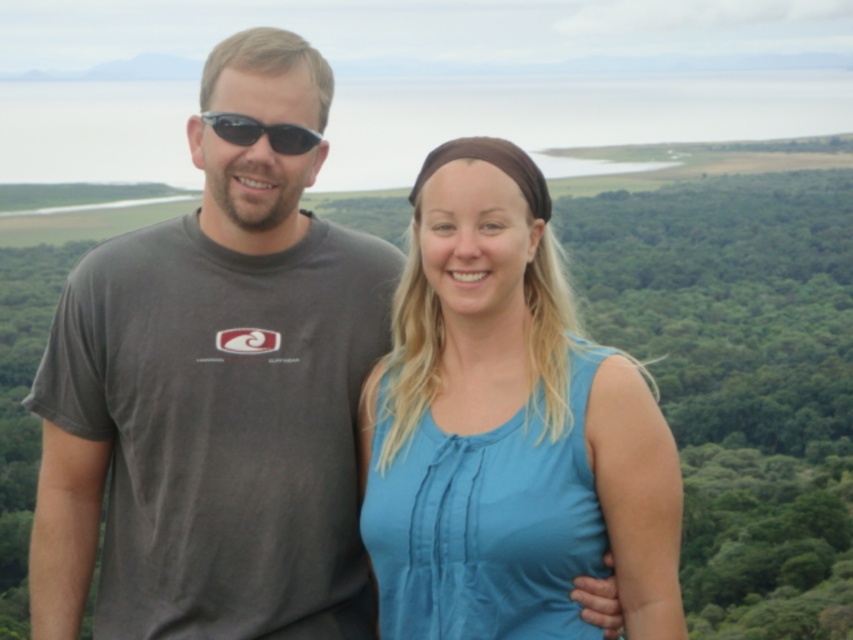
You are a photographer who needs to adjust the lighting for a closeup shot of the blue cotton shirt at right and the black plastic sunglasses at left. Since the background is very bright, you want to ensure both items are equally visible. Which object might require more adjustment due to its size?

The blue cotton shirt at right has a larger size compared to the black plastic sunglasses at left, so it might require more adjustment to ensure it is equally visible in the lighting setup.

You are a photographer trying to capture a clear shot of the blue cotton shirt at right and the black plastic sunglasses at left. Since you want to focus on the shirts and sunglasses, you need to know their relative heights. Which one is taller?

The blue cotton shirt at right is taller than the black plastic sunglasses at left.

You are a photographer trying to capture a photo of the blue cotton shirt at right and the black plastic sunglasses at left. Based on their positions, which object is located to the right side of the image?

The blue cotton shirt at right is located to the right side of the image.